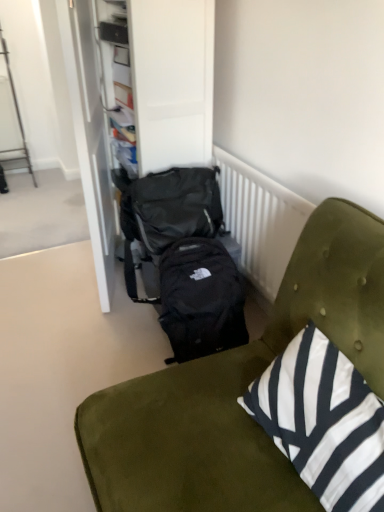
Question: Which direction should I rotate to look at black fabric backpack at center, the second backpack ordered from the bottom, — up or down?

Choices:
 (A) up
 (B) down

Answer: (A)

Question: Does black fabric backpack at center have a smaller size compared to black fabric dresser at center?

Choices:
 (A) yes
 (B) no

Answer: (B)

Question: From a real-world perspective, is black fabric backpack at center located beneath black fabric dresser at center?

Choices:
 (A) yes
 (B) no

Answer: (A)

Question: Considering the relative sizes of black fabric backpack at center and black fabric dresser at center in the image provided, is black fabric backpack at center thinner than black fabric dresser at center?

Choices:
 (A) no
 (B) yes

Answer: (A)

Question: Is black fabric backpack at center outside of black fabric dresser at center?

Choices:
 (A) no
 (B) yes

Answer: (B)

Question: Is black fabric backpack at center positioned before black fabric dresser at center?

Choices:
 (A) yes
 (B) no

Answer: (A)

Question: Considering the relative sizes of black fabric backpack at center and black fabric dresser at center in the image provided, is black fabric backpack at center shorter than black fabric dresser at center?

Choices:
 (A) yes
 (B) no

Answer: (A)

Question: From the image's perspective, is black fabric backpack at center, positioned as the first backpack in top-to-bottom order, under black fabric backpack at center?

Choices:
 (A) yes
 (B) no

Answer: (B)

Question: Is black fabric backpack at center, the second backpack ordered from the bottom, in front of black fabric backpack at center?

Choices:
 (A) no
 (B) yes

Answer: (A)

Question: Does black fabric backpack at center, positioned as the first backpack in top-to-bottom order, have a smaller size compared to black fabric backpack at center?

Choices:
 (A) no
 (B) yes

Answer: (B)

Question: Is black fabric backpack at center, the second backpack ordered from the bottom, looking in the opposite direction of black fabric backpack at center?

Choices:
 (A) no
 (B) yes

Answer: (A)

Question: Is black fabric backpack at center, positioned as the first backpack in top-to-bottom order, to the right of black fabric backpack at center from the viewer's perspective?

Choices:
 (A) no
 (B) yes

Answer: (A)

Question: Could you tell me if black fabric backpack at center, the second backpack ordered from the bottom, is facing black fabric backpack at center?

Choices:
 (A) yes
 (B) no

Answer: (A)

Question: Is black fabric dresser at center taller than white striped fabric pillow at lower right?

Choices:
 (A) no
 (B) yes

Answer: (B)